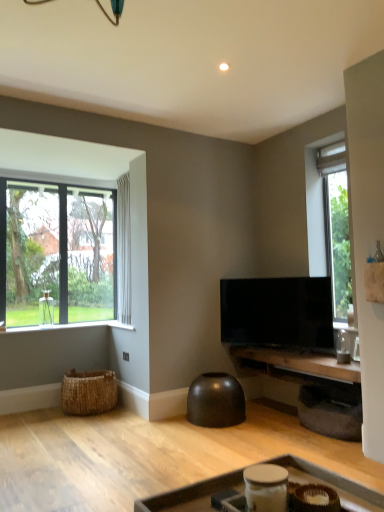
Question: Is woven brown basket at lower left smaller than clear glass window at left?

Choices:
 (A) yes
 (B) no

Answer: (A)

Question: Considering the relative positions of woven brown basket at lower left and clear glass window at left in the image provided, is woven brown basket at lower left behind clear glass window at left?

Choices:
 (A) yes
 (B) no

Answer: (B)

Question: Can you confirm if woven brown basket at lower left is thinner than clear glass window at left?

Choices:
 (A) no
 (B) yes

Answer: (A)

Question: Is the depth of woven brown basket at lower left less than that of clear glass window at left?

Choices:
 (A) no
 (B) yes

Answer: (B)

Question: Would you say woven brown basket at lower left is outside clear glass window at left?

Choices:
 (A) yes
 (B) no

Answer: (A)

Question: From their relative heights in the image, would you say wooden tray at lower center, which is the 2th table in back-to-front order, is taller or shorter than white sheer curtain at left?

Choices:
 (A) short
 (B) tall

Answer: (A)

Question: Is point (380, 501) closer or farther from the camera than point (125, 315)?

Choices:
 (A) farther
 (B) closer

Answer: (B)

Question: In the image, is wooden tray at lower center, marked as the 1th table in a front-to-back arrangement, on the left side or the right side of white sheer curtain at left?

Choices:
 (A) right
 (B) left

Answer: (A)

Question: From a real-world perspective, relative to white sheer curtain at left, is wooden tray at lower center, marked as the 1th table in a front-to-back arrangement, vertically above or below?

Choices:
 (A) below
 (B) above

Answer: (A)

Question: Looking at the image, does clear glass window at left seem bigger or smaller compared to wooden table at center, which is the 2th table from front to back?

Choices:
 (A) small
 (B) big

Answer: (B)

Question: Considering the positions of clear glass window at left and wooden table at center, the 1th table positioned from the back, in the image, is clear glass window at left taller or shorter than wooden table at center, the 1th table positioned from the back,?

Choices:
 (A) short
 (B) tall

Answer: (B)

Question: From a real-world perspective, is clear glass window at left physically located above or below wooden table at center, the 1th table positioned from the back?

Choices:
 (A) below
 (B) above

Answer: (B)

Question: Looking at their shapes, would you say clear glass window at left is wider or thinner than wooden table at center, which is the 2th table from front to back?

Choices:
 (A) thin
 (B) wide

Answer: (A)

Question: Considering the relative positions of wooden tray at lower center, which is the 2th table in back-to-front order, and white wood window sill at lower left in the image provided, is wooden tray at lower center, which is the 2th table in back-to-front order, to the left or to the right of white wood window sill at lower left?

Choices:
 (A) left
 (B) right

Answer: (B)

Question: Is wooden tray at lower center, marked as the 1th table in a front-to-back arrangement, situated inside white wood window sill at lower left or outside?

Choices:
 (A) outside
 (B) inside

Answer: (A)